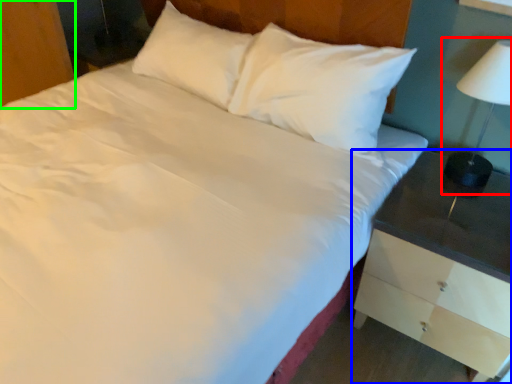
Question: Estimate the real-world distances between objects in this image. Which object is closer to bedside lamp (highlighted by a red box), nightstand (highlighted by a blue box) or dresser (highlighted by a green box)?

Choices:
 (A) nightstand
 (B) dresser

Answer: (A)